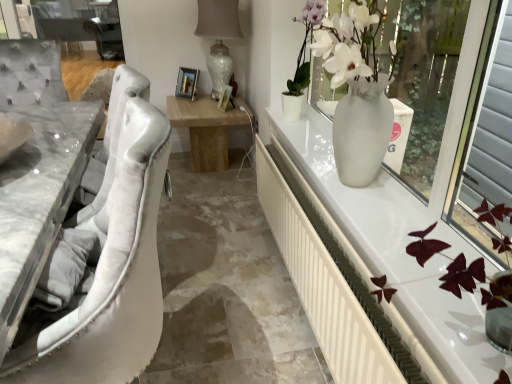
Question: Is white marble table at left not within white glossy vase at upper right?

Choices:
 (A) no
 (B) yes

Answer: (B)

Question: Is white marble table at left thinner than white glossy vase at upper right?

Choices:
 (A) yes
 (B) no

Answer: (B)

Question: From the image's perspective, is white marble table at left on top of white glossy vase at upper right?

Choices:
 (A) no
 (B) yes

Answer: (A)

Question: Does white marble table at left come behind white glossy vase at upper right?

Choices:
 (A) no
 (B) yes

Answer: (A)

Question: Considering the relative sizes of white marble table at left and white glossy vase at upper right in the image provided, is white marble table at left shorter than white glossy vase at upper right?

Choices:
 (A) yes
 (B) no

Answer: (A)

Question: Is white marble table at left facing away from white glossy vase at upper right?

Choices:
 (A) no
 (B) yes

Answer: (B)

Question: Are white glossy vase at right and white plastic radiator at right beside each other?

Choices:
 (A) yes
 (B) no

Answer: (B)

Question: Is white glossy vase at right completely or partially outside of white plastic radiator at right?

Choices:
 (A) no
 (B) yes

Answer: (B)

Question: Does white glossy vase at right appear on the right side of white plastic radiator at right?

Choices:
 (A) no
 (B) yes

Answer: (B)

Question: Can you confirm if white glossy vase at right is bigger than white plastic radiator at right?

Choices:
 (A) yes
 (B) no

Answer: (A)

Question: From the image's perspective, is white glossy vase at right below white plastic radiator at right?

Choices:
 (A) yes
 (B) no

Answer: (B)

Question: Would you consider white glossy vase at right to be distant from white plastic radiator at right?

Choices:
 (A) yes
 (B) no

Answer: (A)

Question: From a real-world perspective, is white glossy vase at right below white marble table at left?

Choices:
 (A) no
 (B) yes

Answer: (A)